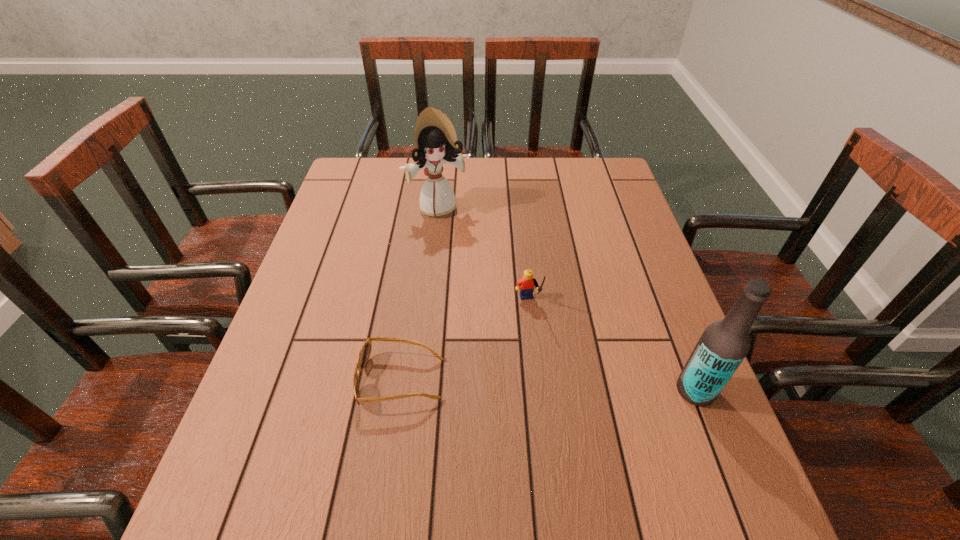
Find the location of `free space on the desktop that is between the shortest object and the rightmost object and is positioned at the front face of the doll`. free space on the desktop that is between the shortest object and the rightmost object and is positioned at the front face of the doll is located at coordinates (531, 384).

Image resolution: width=960 pixels, height=540 pixels. I want to click on vacant spot on the desktop that is between the shortest object and the beer bottle and is positioned on the front-facing side of the Lego, so click(550, 385).